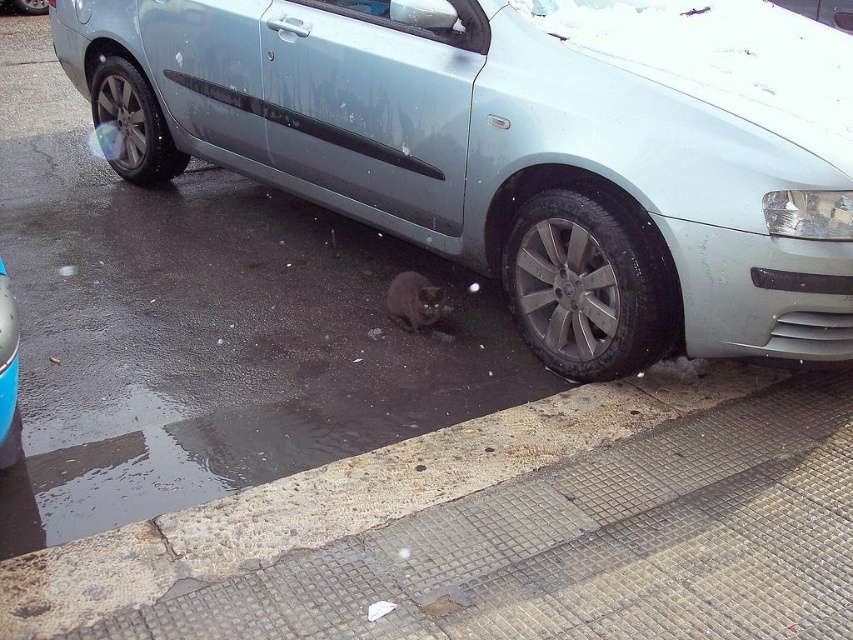
You are a delivery person trying to park your van in the parking lot. You see the slate metallic car at center and the black rubber tire at lower left. Which object is closer to the parking spot entrance?

The slate metallic car at center is closer to the parking spot entrance because it is positioned in front of the black rubber tire at lower left.

You are a photographer trying to capture a clear photo of the black rubber tire at lower left and the gray fur cat at lower center. Which object is closer to you, the photographer?

The black rubber tire at lower left is closer to the photographer because it is further to the viewer than the gray fur cat at lower center.